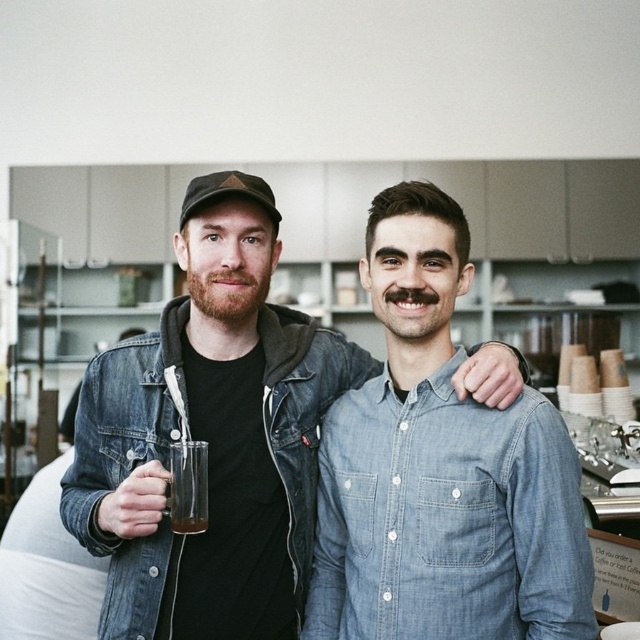
Based on the photo, can you confirm if denim shirt at center is positioned above translucent glass at lower left?

Indeed, denim shirt at center is positioned over translucent glass at lower left.

Is denim shirt at center smaller than translucent glass at lower left?

No, denim shirt at center is not smaller than translucent glass at lower left.

Describe the element at coordinates (440, 470) in the screenshot. I see `denim shirt at center` at that location.

Locate an element on the screen. The image size is (640, 640). denim shirt at center is located at coordinates (440, 470).

Between denim shirt at center and translucent glass mug at center, which one is positioned lower?

translucent glass mug at center is lower down.

Is point (321, 465) positioned after point (177, 504)?

Yes.

The height and width of the screenshot is (640, 640). Find the location of `denim shirt at center`. denim shirt at center is located at coordinates (440, 470).

Which of these two, denim jacket at center or translucent glass at lower left, stands taller?

denim jacket at center is taller.

Is denim jacket at center smaller than translucent glass at lower left?

Actually, denim jacket at center might be larger than translucent glass at lower left.

Measure the distance between denim jacket at center and camera.

They are 1.20 meters apart.

Locate an element on the screen. The width and height of the screenshot is (640, 640). denim jacket at center is located at coordinates (209, 436).